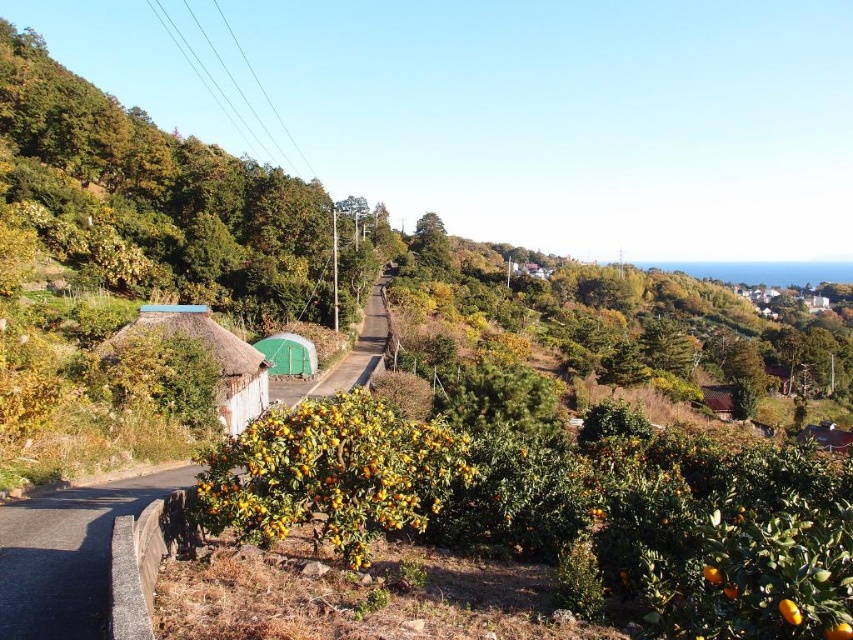
Question: Does green thatched roof hut at center have a lesser width compared to brown thatched hut at upper right?

Choices:
 (A) no
 (B) yes

Answer: (B)

Question: Which of these objects is positioned closest to the white thatch hut at left?

Choices:
 (A) brown thatched hut at upper right
 (B) green thatched roof hut at center

Answer: (B)

Question: Is green thatch roof at left behind green thatched roof hut at center?

Choices:
 (A) yes
 (B) no

Answer: (A)

Question: Which of the following is the farthest from the observer?

Choices:
 (A) green thatched roof hut at center
 (B) brown thatched hut at upper right
 (C) yellow-green glossy orange tree at center

Answer: (B)

Question: Does yellow-green glossy orange tree at center have a smaller size compared to green thatched roof hut at center?

Choices:
 (A) no
 (B) yes

Answer: (B)

Question: Estimate the real-world distances between objects in this image. Which object is closer to the green thatched roof hut at center?

Choices:
 (A) white thatch hut at left
 (B) brown thatched hut at upper right
 (C) yellow-green glossy orange tree at center

Answer: (A)